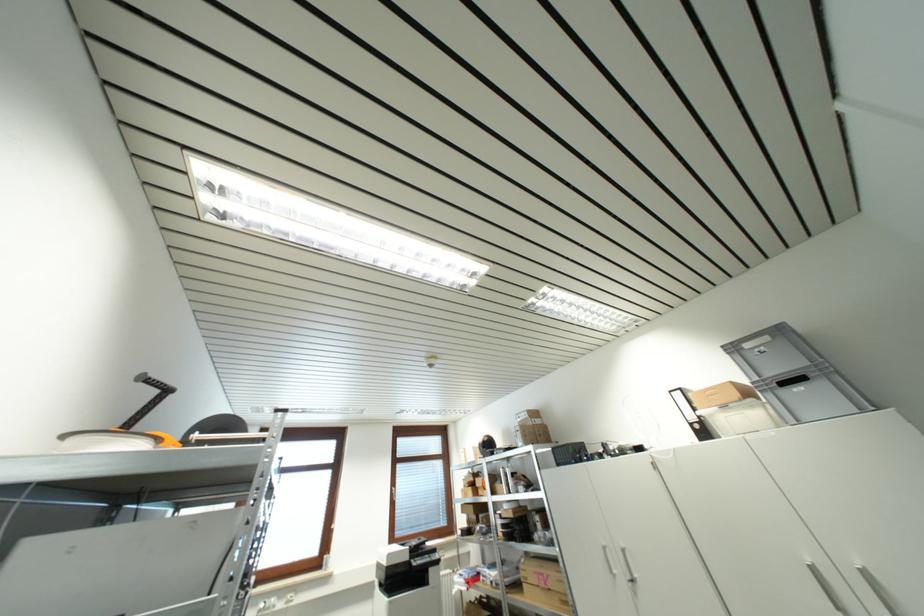
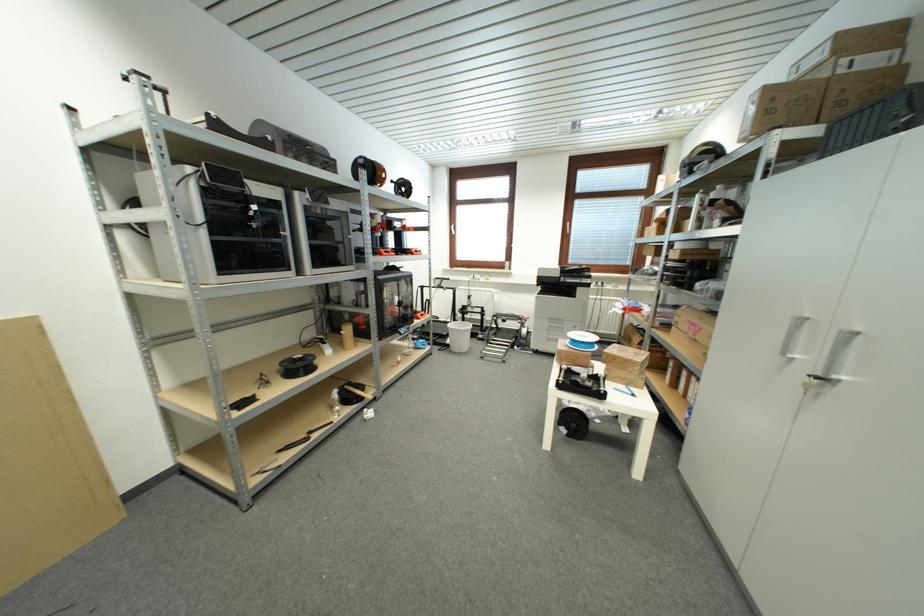
In the second image, find the point that corresponds to (634,581) in the first image.

(822, 376)